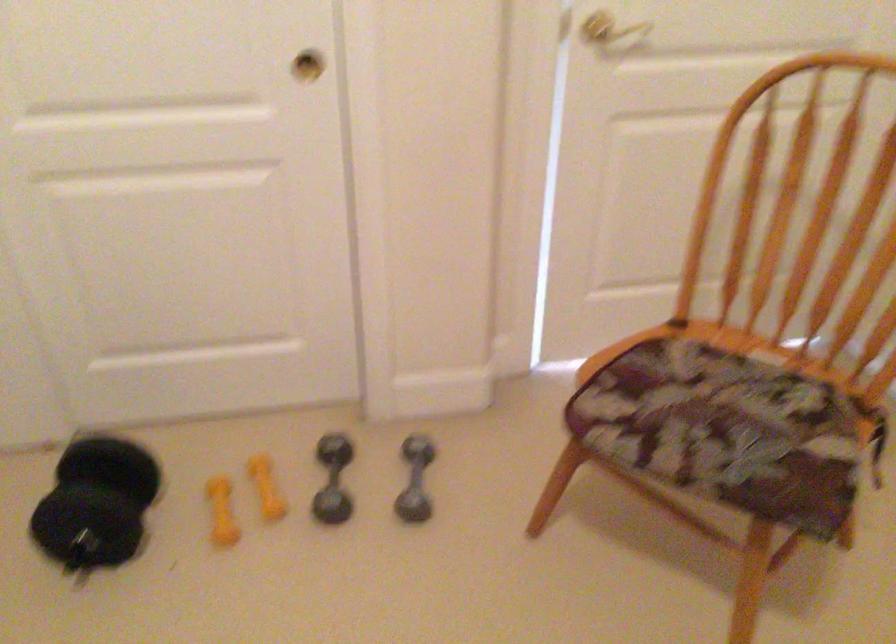
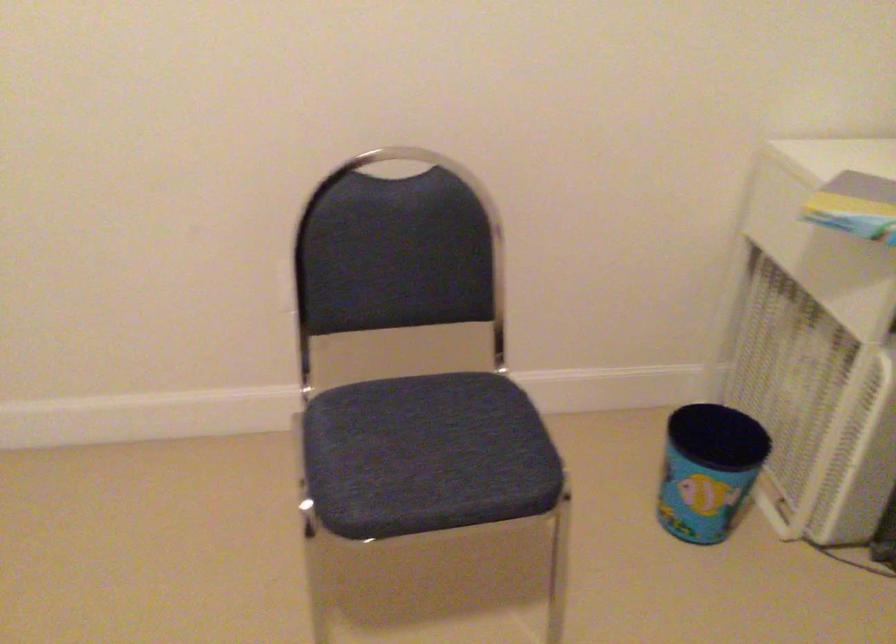
How did the camera likely rotate?

The camera's rotation is toward right-down.